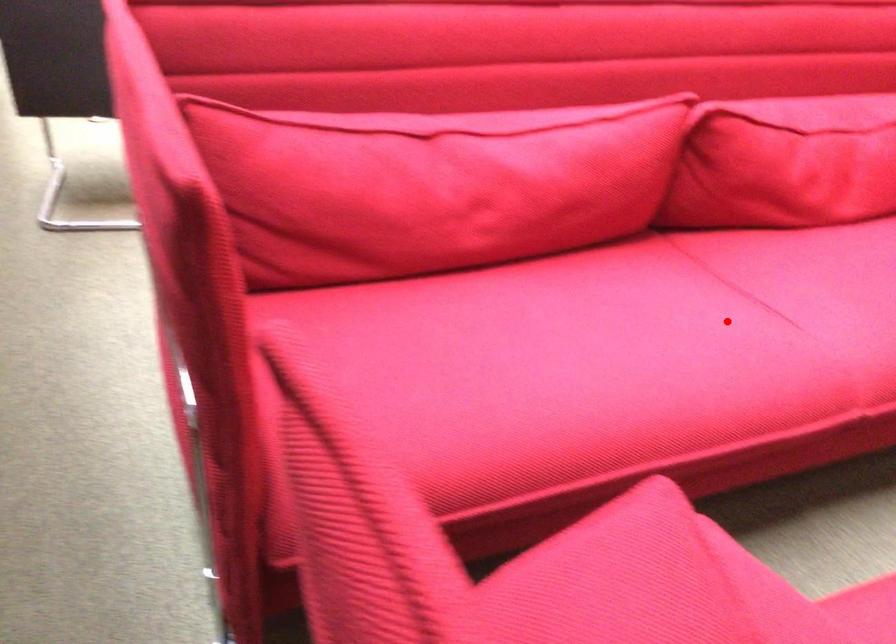
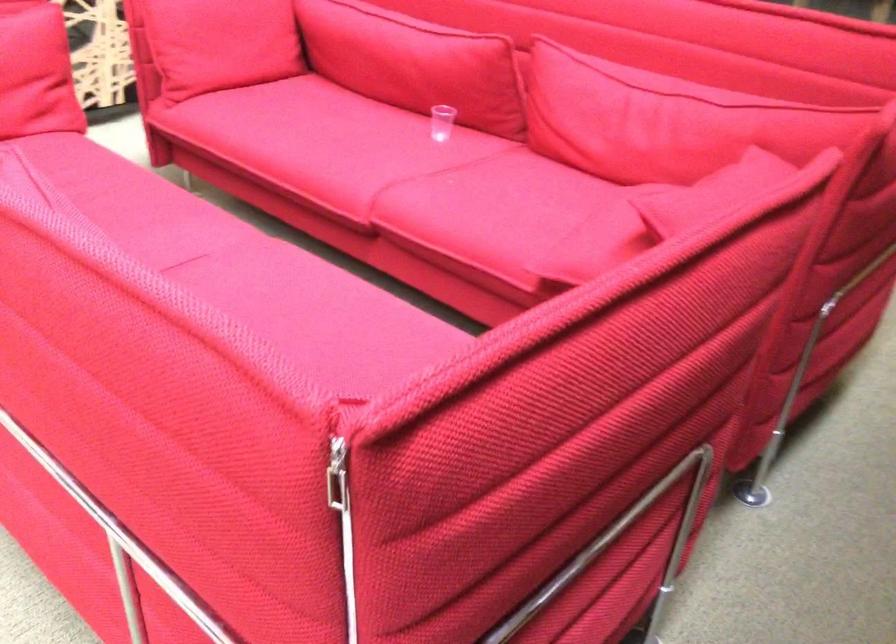
Question: I am providing you with two images of the same scene from different viewpoints. Image1 has a red point marked. In image2, the corresponding 3D location appears at what relative position? Reply with the corresponding letter.

Choices:
 (A) Closer
 (B) Farther

Answer: (B)